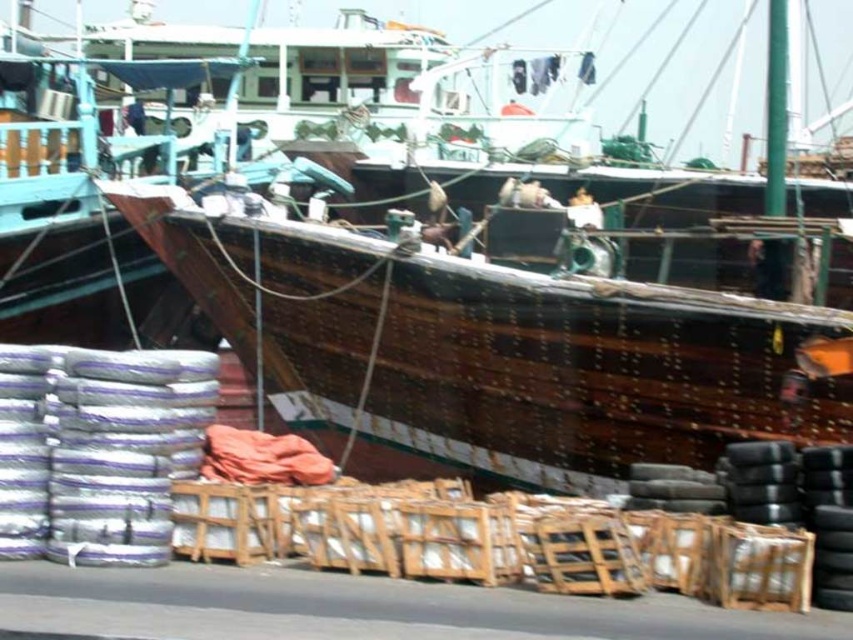
Looking at this image, is wooden boat at center further to camera compared to black rubber tires at lower right?

Yes, it is.

The image size is (853, 640). What do you see at coordinates (523, 296) in the screenshot?
I see `wooden boat at center` at bounding box center [523, 296].

At what (x,y) coordinates should I click in order to perform the action: click on wooden boat at center. Please return your answer as a coordinate pair (x, y). Looking at the image, I should click on (523, 296).